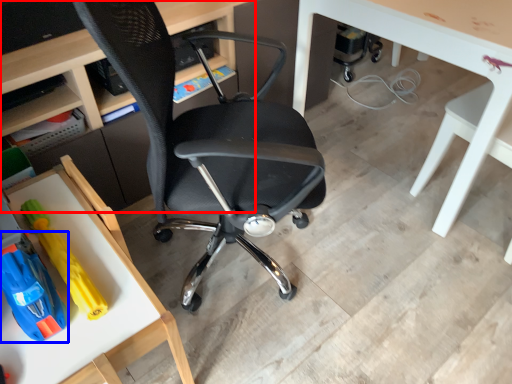
Question: Which of the following is the closest to the observer, desk (highlighted by a red box) or toy (highlighted by a blue box)?

Choices:
 (A) desk
 (B) toy

Answer: (B)